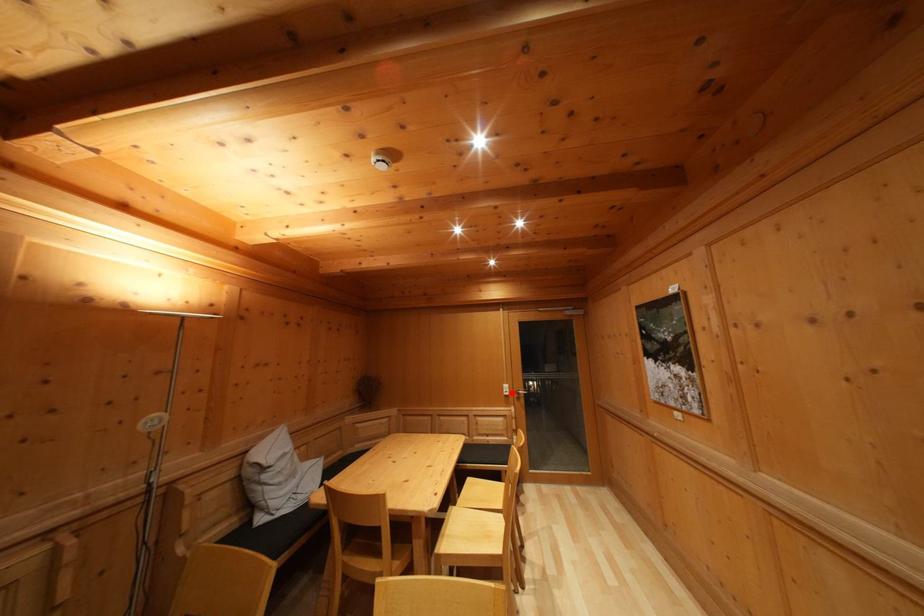
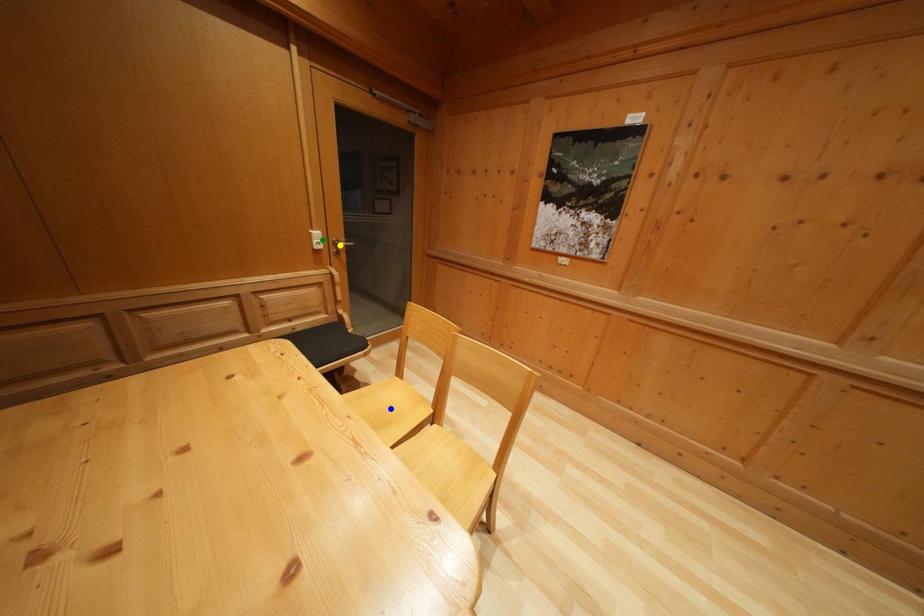
Question: I am providing you with two images of the same scene from different viewpoints. A red point is marked on the first image. You are given multiple points on the second image. Which point in image 2 is actually the same real-world point as the red point in image 1?

Choices:
 (A) green point
 (B) yellow point
 (C) blue point

Answer: (A)